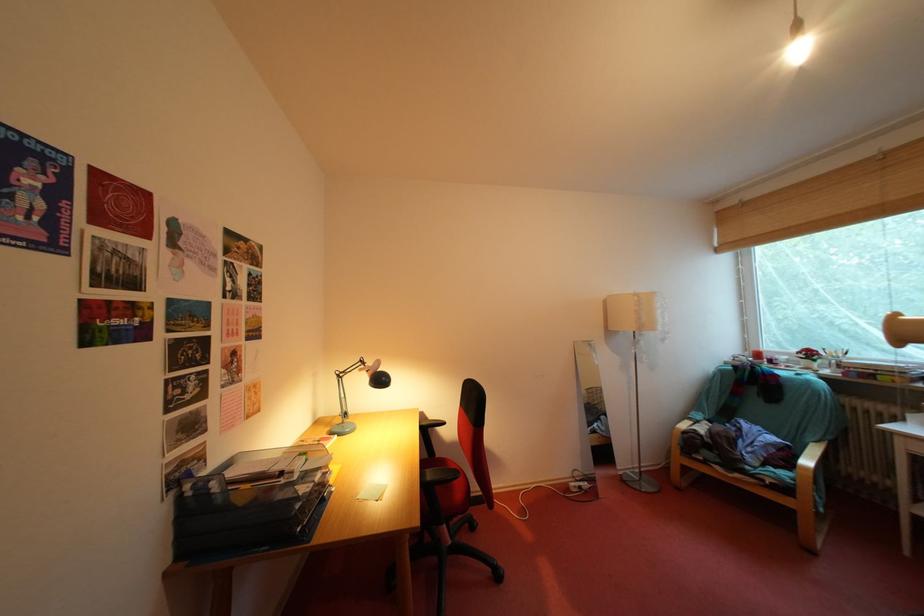
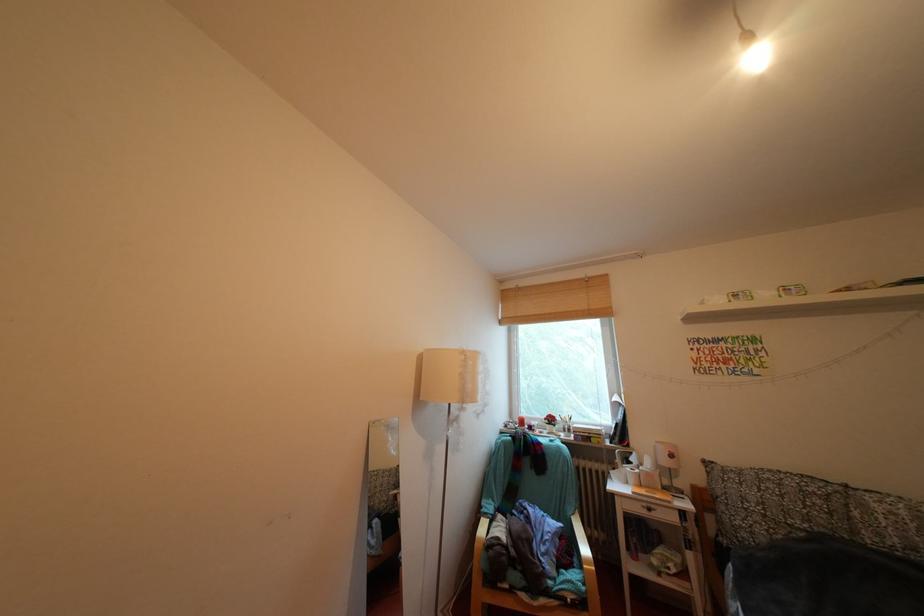
Question: Based on the continuous images, in which direction is the camera rotating? Reply with the corresponding letter.

Choices:
 (A) Left
 (B) Right
 (C) Up
 (D) Down

Answer: (B)